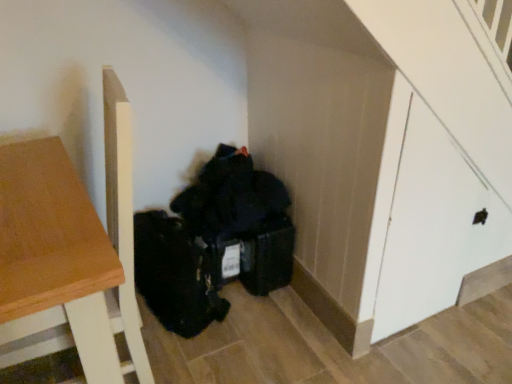
Describe the element at coordinates (56, 251) in the screenshot. The width and height of the screenshot is (512, 384). I see `wooden table at left` at that location.

The height and width of the screenshot is (384, 512). Identify the location of wooden table at left. (56, 251).

This screenshot has width=512, height=384. In order to click on white matte door at right in this screenshot , I will do `click(434, 226)`.

What do you see at coordinates (434, 226) in the screenshot? The height and width of the screenshot is (384, 512). I see `white matte door at right` at bounding box center [434, 226].

Find the location of a particular element. wooden table at left is located at coordinates (56, 251).

Considering the positions of objects white matte door at right and wooden table at left in the image provided, who is more to the right, white matte door at right or wooden table at left?

white matte door at right.

Is the position of white matte door at right more distant than that of wooden table at left?

Yes, it is behind wooden table at left.

Which point is more forward, (462,219) or (100,285)?

The point (100,285) is more forward.

From the image's perspective, is white matte door at right on top of wooden table at left?

Indeed, from the image's perspective, white matte door at right is shown above wooden table at left.

From a real-world perspective, is white matte door at right above or below wooden table at left?

white matte door at right is situated higher than wooden table at left in the real world.

Which object is thinner, white matte door at right or wooden table at left?

Thinner between the two is white matte door at right.

From their relative heights in the image, would you say white matte door at right is taller or shorter than wooden table at left?

Considering their sizes, white matte door at right has more height than wooden table at left.

Does white matte door at right have a larger size compared to wooden table at left?

Actually, white matte door at right might be smaller than wooden table at left.

Is white matte door at right located outside wooden table at left?

→ white matte door at right lies outside wooden table at left's area.

Is there a large distance between white matte door at right and wooden table at left?

That's right, there is a large distance between white matte door at right and wooden table at left.

Is white matte door at right positioned with its back to wooden table at left?

white matte door at right is not turned away from wooden table at left.

How different are the orientations of white matte door at right and wooden table at left in degrees?

92.4 degrees separate the facing orientations of white matte door at right and wooden table at left.

This screenshot has height=384, width=512. What are the coordinates of `door lying behind the wooden table at left` in the screenshot? It's located at (434, 226).

Considering the positions of objects wooden table at left and white matte door at right in the image provided, who is more to the right, wooden table at left or white matte door at right?

From the viewer's perspective, white matte door at right appears more on the right side.

Does wooden table at left come in front of white matte door at right?

Yes, it is.

Is point (92, 340) closer or farther from the camera than point (431, 277)?

Point (92, 340) is positioned closer to the camera compared to point (431, 277).

From the image's perspective, is wooden table at left on white matte door at right?

Incorrect, from the image's perspective, wooden table at left is lower than white matte door at right.

From a real-world perspective, is wooden table at left above or below white matte door at right?

wooden table at left is below white matte door at right.

Is wooden table at left thinner than white matte door at right?

No, wooden table at left is not thinner than white matte door at right.

Is wooden table at left shorter than white matte door at right?

Yes.

Can you confirm if wooden table at left is smaller than white matte door at right?

Incorrect, wooden table at left is not smaller in size than white matte door at right.

Is wooden table at left surrounding white matte door at right?

No.

Does wooden table at left touch white matte door at right?

No, wooden table at left is not next to white matte door at right.

Is wooden table at left oriented away from white matte door at right?

wooden table at left does not have its back to white matte door at right.

How many degrees apart are the facing directions of wooden table at left and white matte door at right?

92.4 degrees separate the facing orientations of wooden table at left and white matte door at right.

How distant is wooden table at left from white matte door at right?

wooden table at left and white matte door at right are 1.04 meters apart from each other.

You are a GUI agent. You are given a task and a screenshot of the screen. Output one action in this format:
    pyautogui.click(x=<x>, y=<y>)
    Task: Click on the table located on the left of white matte door at right
    The image size is (512, 384).
    Given the screenshot: What is the action you would take?
    pyautogui.click(x=56, y=251)

At what (x,y) coordinates should I click in order to perform the action: click on door that appears above the wooden table at left (from the image's perspective). Please return your answer as a coordinate pair (x, y). This screenshot has width=512, height=384. Looking at the image, I should click on (434, 226).

Where is `table that appears on the left of white matte door at right`? table that appears on the left of white matte door at right is located at coordinates (56, 251).